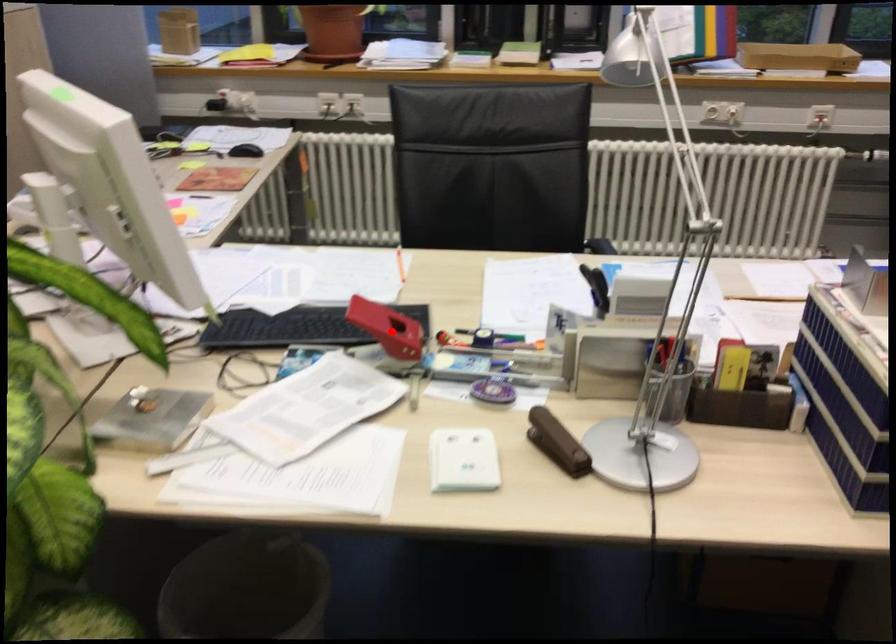
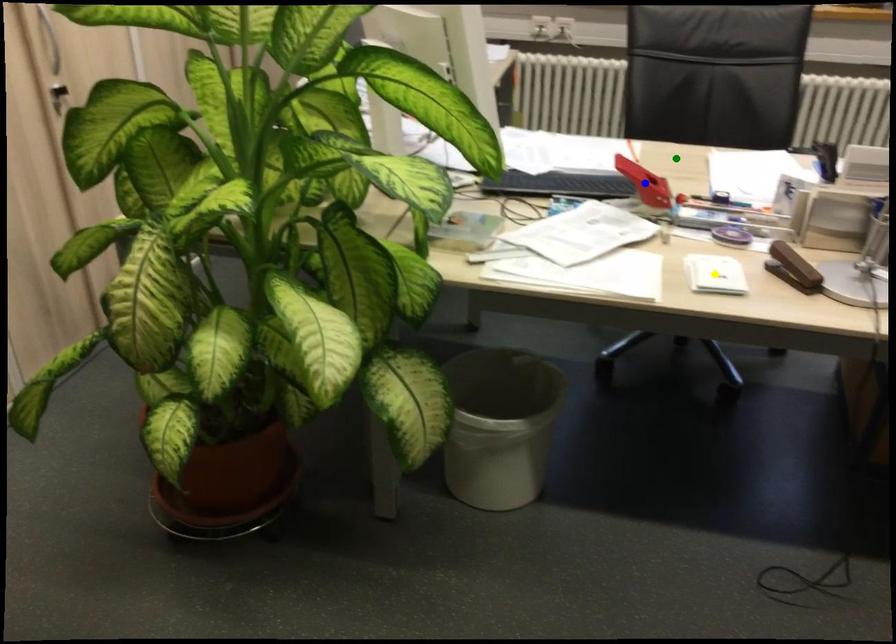
Question: I am providing you with two images of the same scene from different viewpoints. A red point is marked on the first image. You are given multiple points on the second image. Which mark in image 2 goes with the point in image 1?

Choices:
 (A) yellow point
 (B) blue point
 (C) green point

Answer: (B)